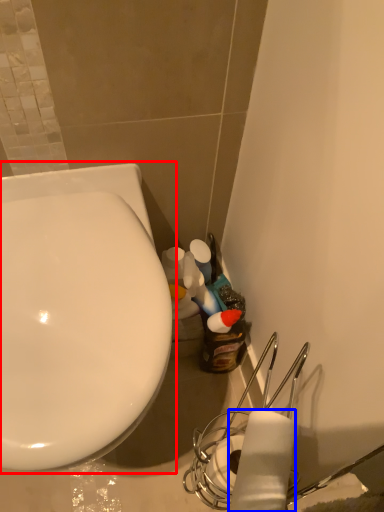
Question: Which object is closer to the camera taking this photo, toilet (highlighted by a red box) or toilet paper (highlighted by a blue box)?

Choices:
 (A) toilet
 (B) toilet paper

Answer: (B)